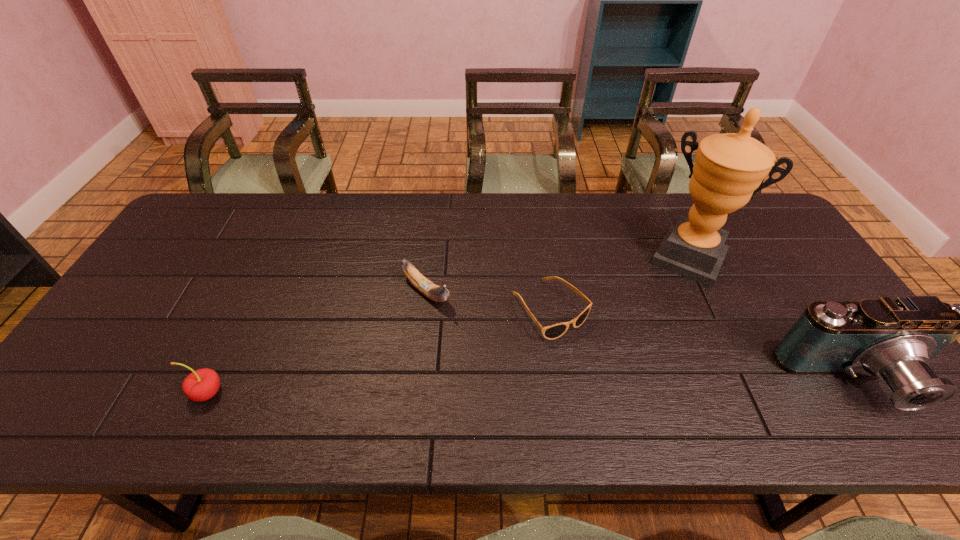
I want to click on vacant point that satisfies the following two spatial constraints: 1. on the front side of the third object from right to left; 2. on the left side of the fourth object from right to left, so click(x=424, y=309).